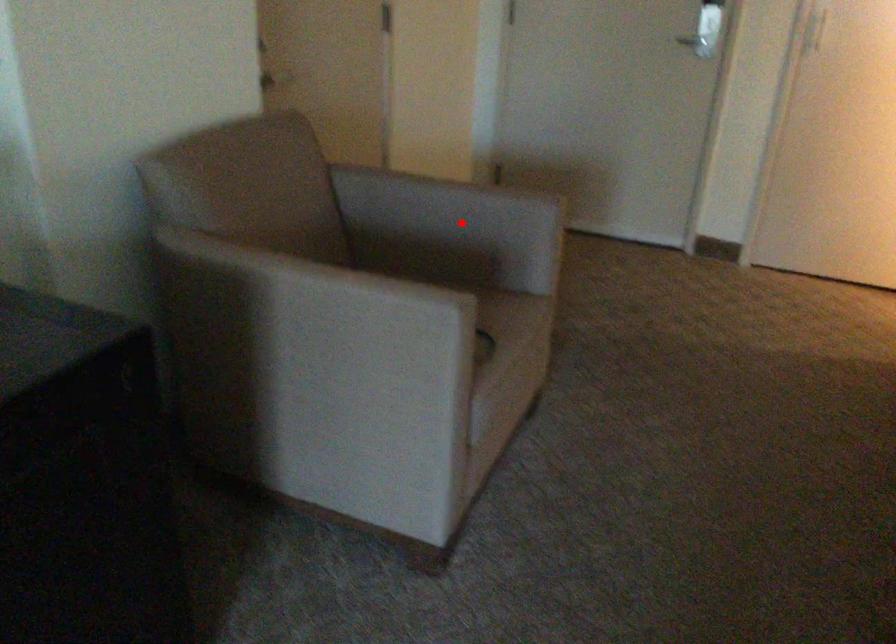
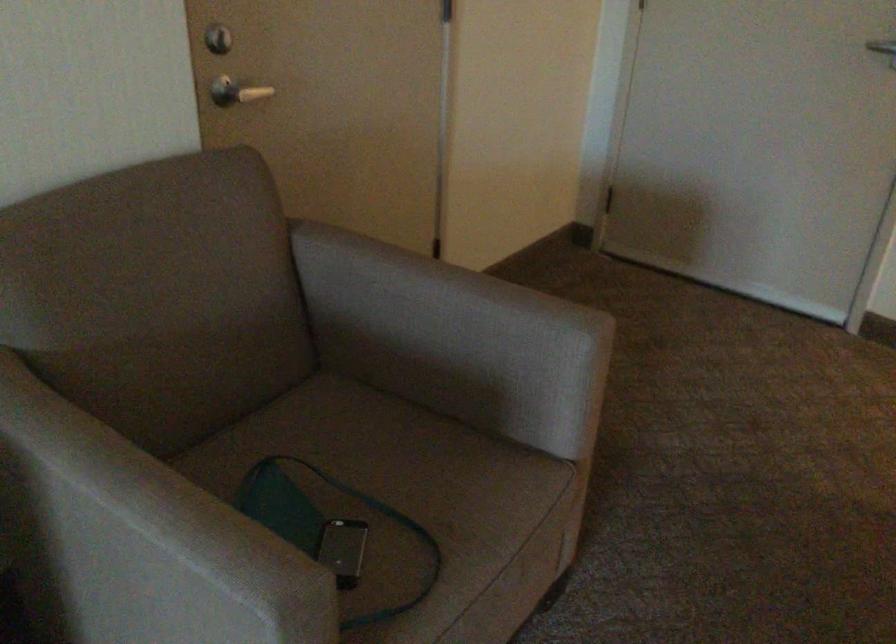
Find the pixel in the second image that matches the highlighted location in the first image.

(453, 339)